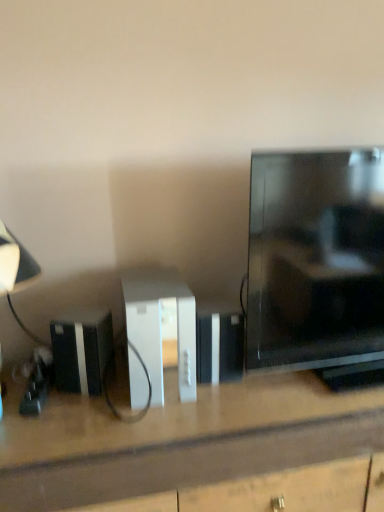
Find the location of a particular element. The image size is (384, 512). free space in front of black plastic speaker at lower left is located at coordinates (75, 428).